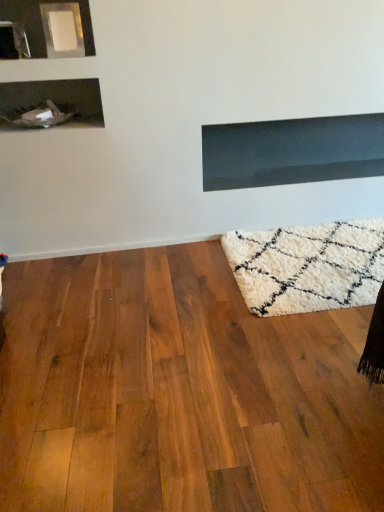
Question: Should I look upward or downward to see shiny brown hardwood floor at lower right?

Choices:
 (A) down
 (B) up

Answer: (A)

Question: From the image's perspective, is shiny brown hardwood floor at lower right over matte black fireplace at upper center?

Choices:
 (A) yes
 (B) no

Answer: (B)

Question: Considering the relative sizes of shiny brown hardwood floor at lower right and matte black fireplace at upper center in the image provided, is shiny brown hardwood floor at lower right bigger than matte black fireplace at upper center?

Choices:
 (A) no
 (B) yes

Answer: (B)

Question: Can you confirm if shiny brown hardwood floor at lower right is smaller than matte black fireplace at upper center?

Choices:
 (A) yes
 (B) no

Answer: (B)

Question: Is shiny brown hardwood floor at lower right far away from matte black fireplace at upper center?

Choices:
 (A) yes
 (B) no

Answer: (A)

Question: Does shiny brown hardwood floor at lower right have a greater width compared to matte black fireplace at upper center?

Choices:
 (A) yes
 (B) no

Answer: (A)

Question: Does shiny brown hardwood floor at lower right have a lesser height compared to matte black fireplace at upper center?

Choices:
 (A) yes
 (B) no

Answer: (A)

Question: Is matte black fireplace at upper center behind shiny brown hardwood floor at lower right?

Choices:
 (A) no
 (B) yes

Answer: (B)

Question: Can you confirm if matte black fireplace at upper center is taller than shiny brown hardwood floor at lower right?

Choices:
 (A) no
 (B) yes

Answer: (B)

Question: Are matte black fireplace at upper center and shiny brown hardwood floor at lower right far apart?

Choices:
 (A) yes
 (B) no

Answer: (A)

Question: Considering the relative positions of matte black fireplace at upper center and shiny brown hardwood floor at lower right in the image provided, is matte black fireplace at upper center to the left of shiny brown hardwood floor at lower right from the viewer's perspective?

Choices:
 (A) yes
 (B) no

Answer: (B)

Question: From the image's perspective, is matte black fireplace at upper center located beneath shiny brown hardwood floor at lower right?

Choices:
 (A) no
 (B) yes

Answer: (A)

Question: Can you confirm if matte black fireplace at upper center is bigger than shiny brown hardwood floor at lower right?

Choices:
 (A) no
 (B) yes

Answer: (A)

Question: Choose the correct answer: Is shiny brown hardwood floor at lower right inside matte black fireplace at upper center or outside it?

Choices:
 (A) inside
 (B) outside

Answer: (B)